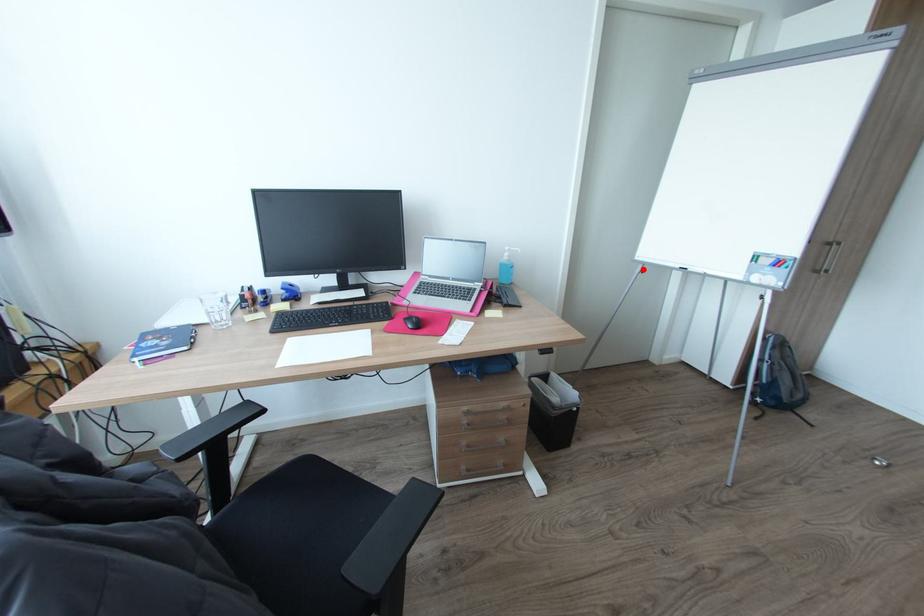
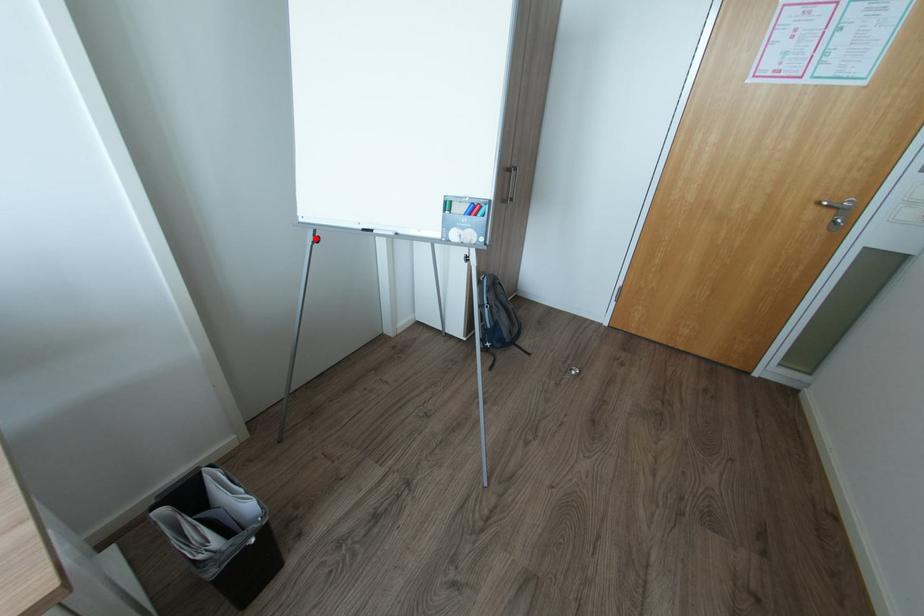
I am providing you with two images of the same scene from different viewpoints. A red point is marked on the first image and another point is marked on the second image. Does the point marked in image1 correspond to the same location as the one in image2?

Yes